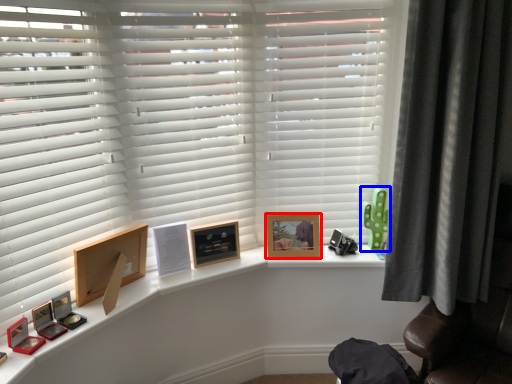
Question: Which object is closer to the camera taking this photo, picture frame (highlighted by a red box) or toy (highlighted by a blue box)?

Choices:
 (A) picture frame
 (B) toy

Answer: (A)